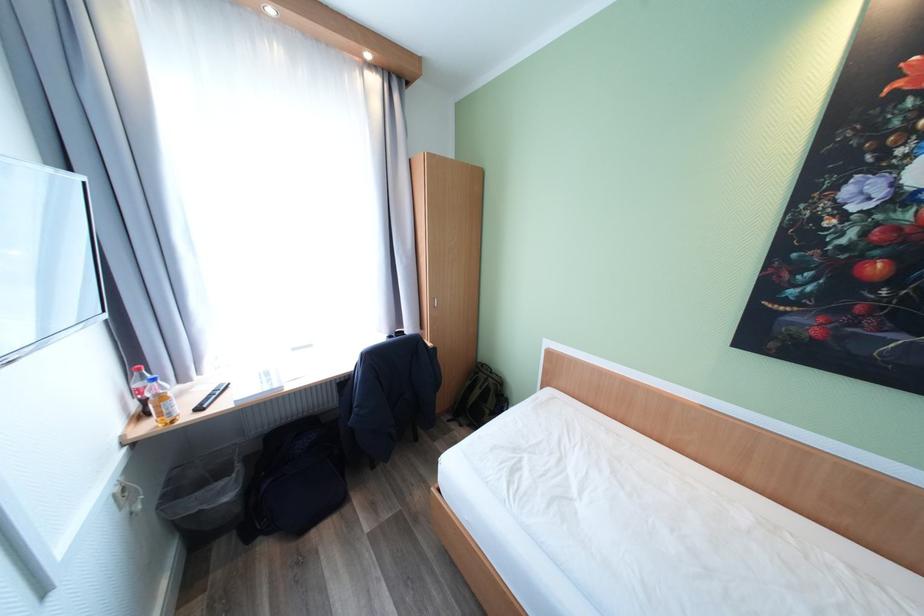
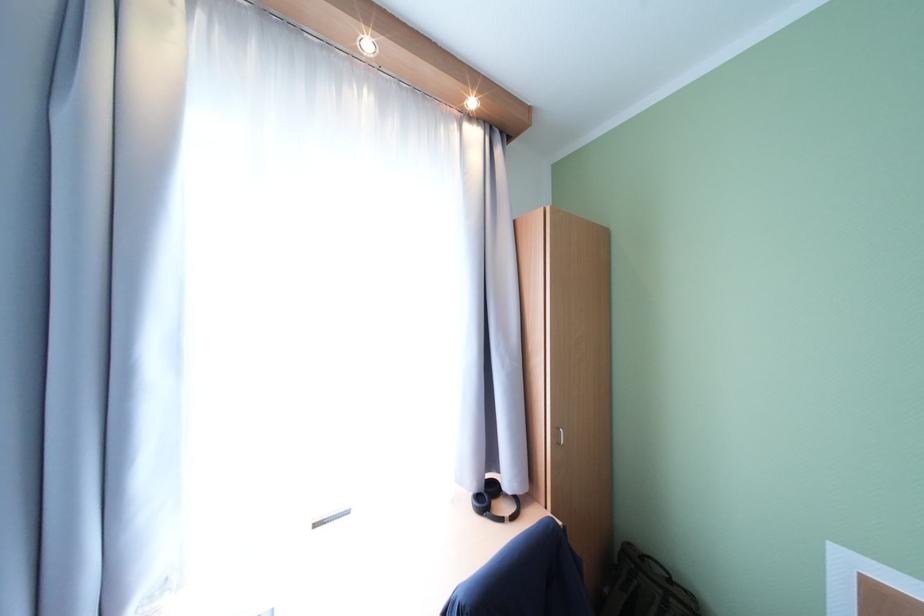
Locate, in the second image, the point that corresponds to pixel 440 307 in the first image.

(563, 444)